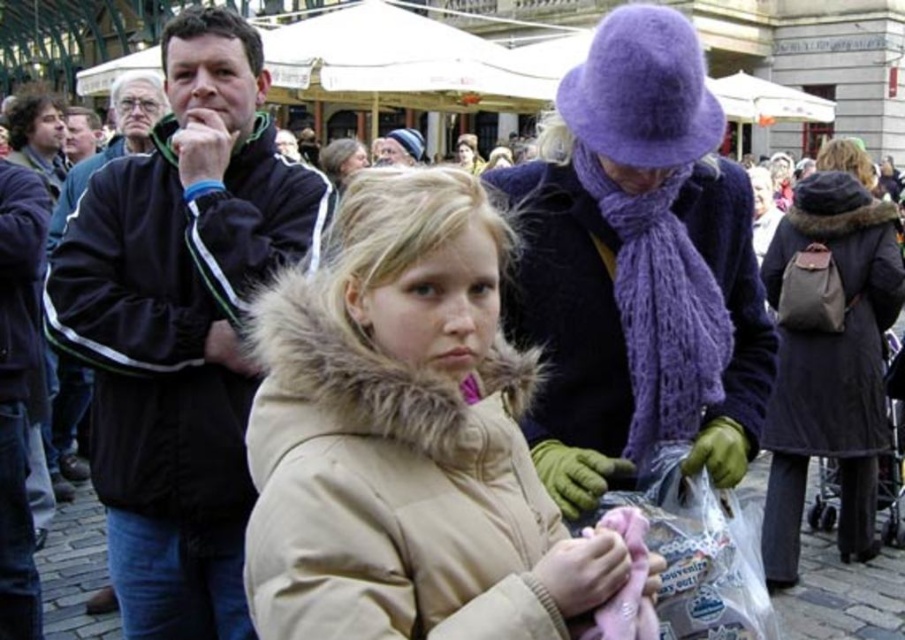
You are a fashion designer observing the crowd in the scene. You notice two coats that caught your attention. The black velour jacket at left and the dark brown leather coat at center. Which one is smaller in size?

The black velour jacket at left is smaller than the dark brown leather coat at center.

You are a shopper who wants to buy a jacket and you see two jackets displayed at the left side of the store. The first is a black velour jacket at left and the second is a black fleece jacket at left. Which one is more to the right?

The black velour jacket at left is more to the right because it is positioned on the right side of the black fleece jacket at left.